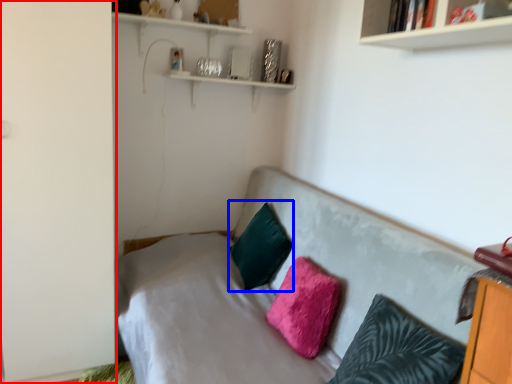
Question: Which point is closer to the camera, side (highlighted by a red box) or pillow (highlighted by a blue box)?

Choices:
 (A) side
 (B) pillow

Answer: (A)